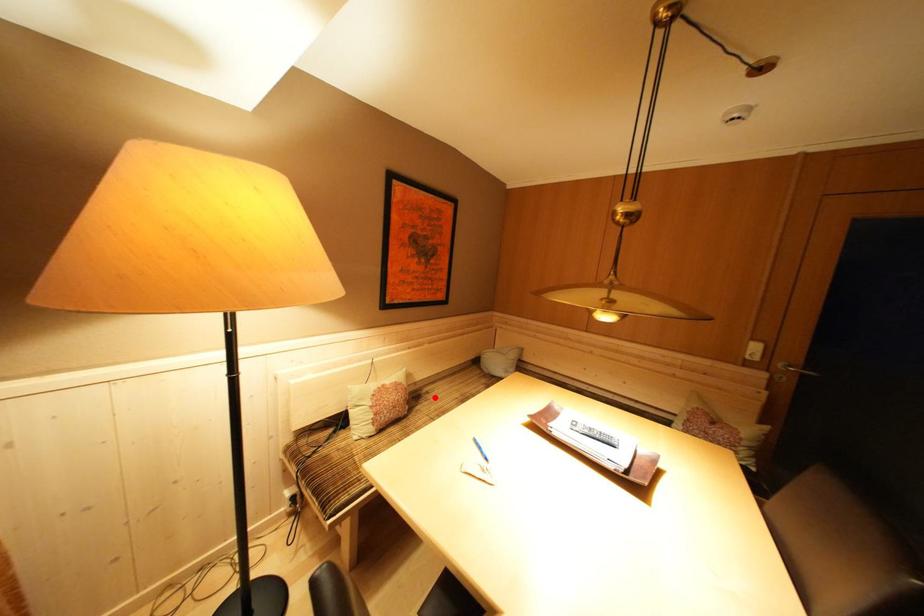
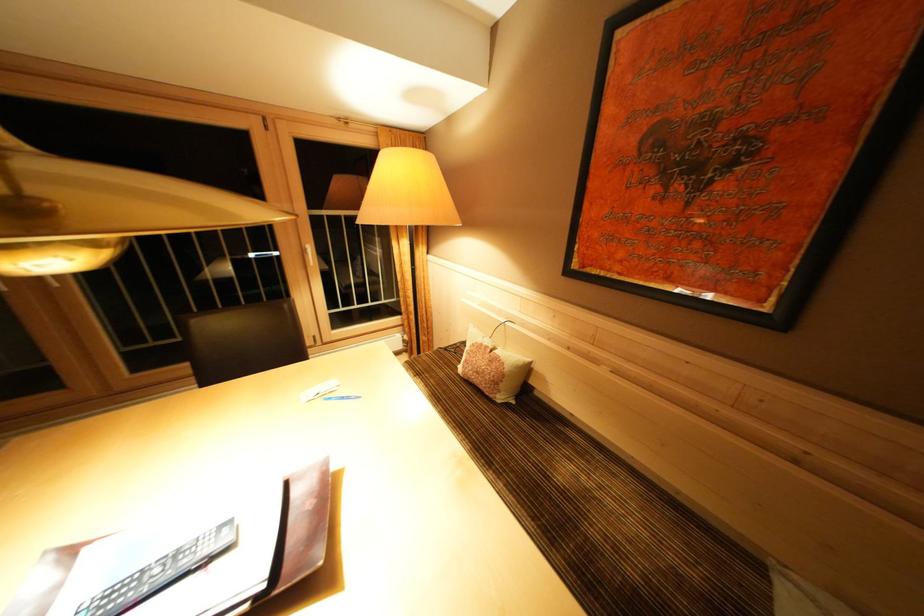
Where in the second image is the point corresponding to the highlighted location from the first image?

(565, 438)